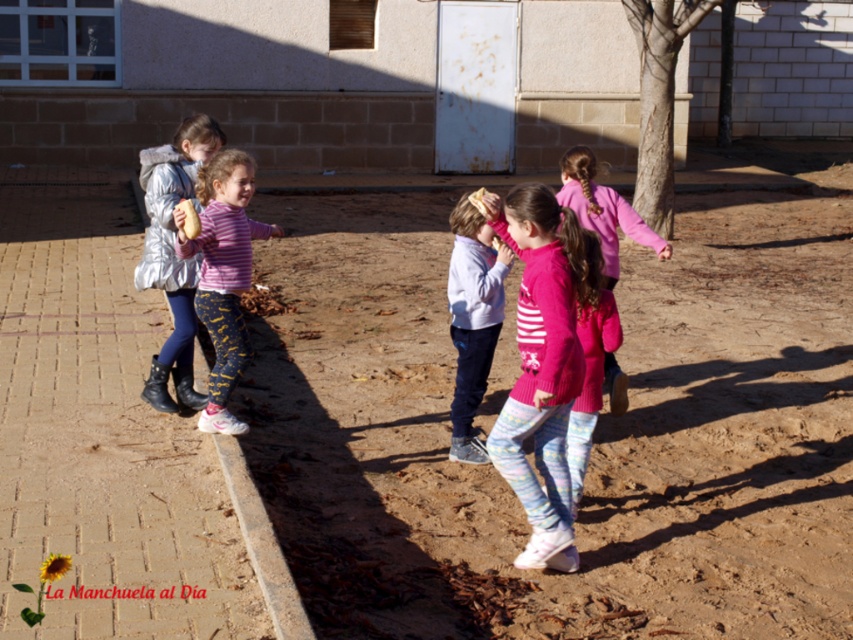
Question: Considering the real-world distances, which object is closest to the brown sandy ground at center?

Choices:
 (A) light blue fleece jacket at center
 (B) brick pavement at left
 (C) silver metallic jacket at left
 (D) knitted pink sweater at center

Answer: (D)

Question: From the image, what is the correct spatial relationship of brown sandy ground at center in relation to pink fleece jacket at center?

Choices:
 (A) right
 (B) left

Answer: (B)

Question: Is brick pavement at left to the left of silver metallic jacket at left from the viewer's perspective?

Choices:
 (A) yes
 (B) no

Answer: (A)

Question: Considering the real-world distances, which object is farthest from the striped cotton shirt at center?

Choices:
 (A) knitted pink sweater at center
 (B) pink fleece jacket at center
 (C) brown sandy ground at center

Answer: (C)

Question: Which of these objects is positioned closest to the brick pavement at left?

Choices:
 (A) silver metallic jacket at left
 (B) light blue fleece jacket at center
 (C) striped cotton shirt at center

Answer: (C)

Question: Observing the image, what is the correct spatial positioning of silver metallic jacket at left in reference to pink fleece jacket at center?

Choices:
 (A) below
 (B) above

Answer: (A)